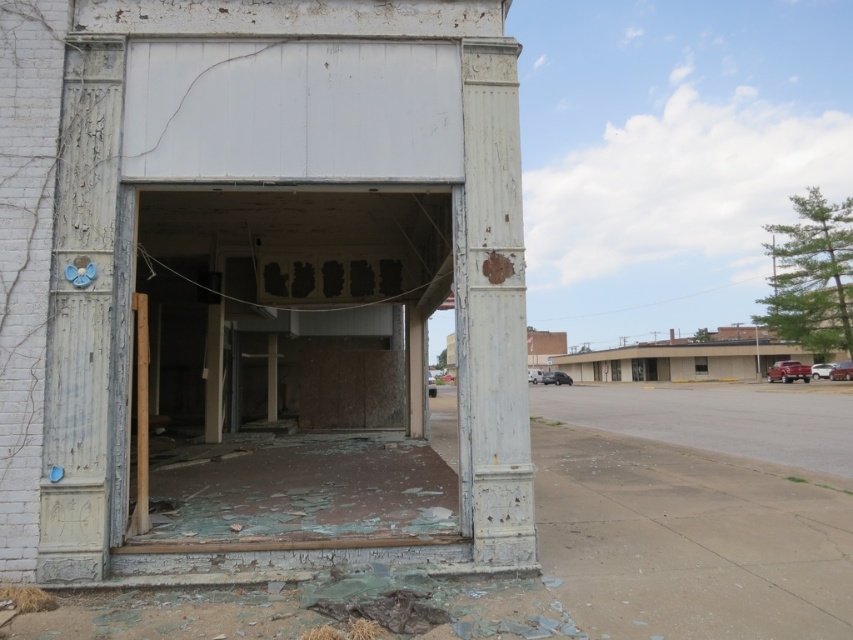
Looking at this image, which of these two, peeling paint garage door at center or white peeling paint at upper center, stands taller?

With more height is peeling paint garage door at center.

Is point (398, 458) positioned behind point (512, 348)?

Yes, it is behind point (512, 348).

From the picture: Who is more distant from viewer, (316, 518) or (468, 448)?

The point (316, 518) is behind.

I want to click on peeling paint garage door at center, so click(x=288, y=364).